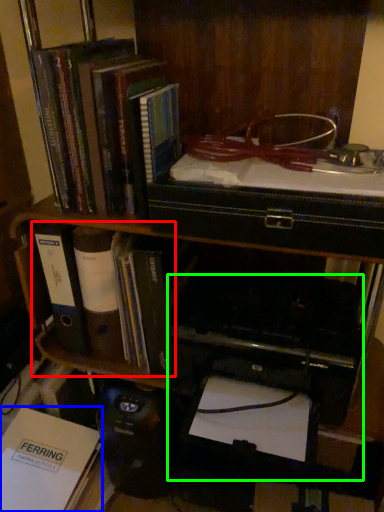
Question: Estimate the real-world distances between objects in this image. Which object is farther from book (highlighted by a red box), book (highlighted by a blue box) or printer (highlighted by a green box)?

Choices:
 (A) book
 (B) printer

Answer: (A)